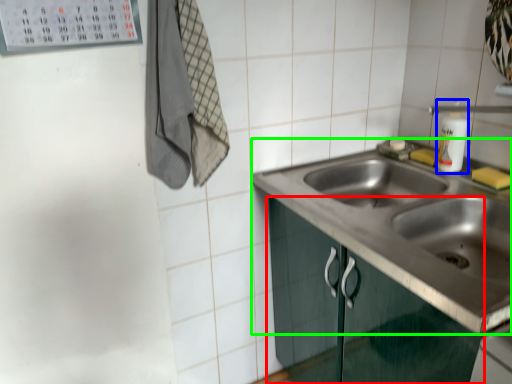
Question: Estimate the real-world distances between objects in this image. Which object is farther from cabinetry (highlighted by a red box), bottle (highlighted by a blue box) or sink (highlighted by a green box)?

Choices:
 (A) bottle
 (B) sink

Answer: (A)